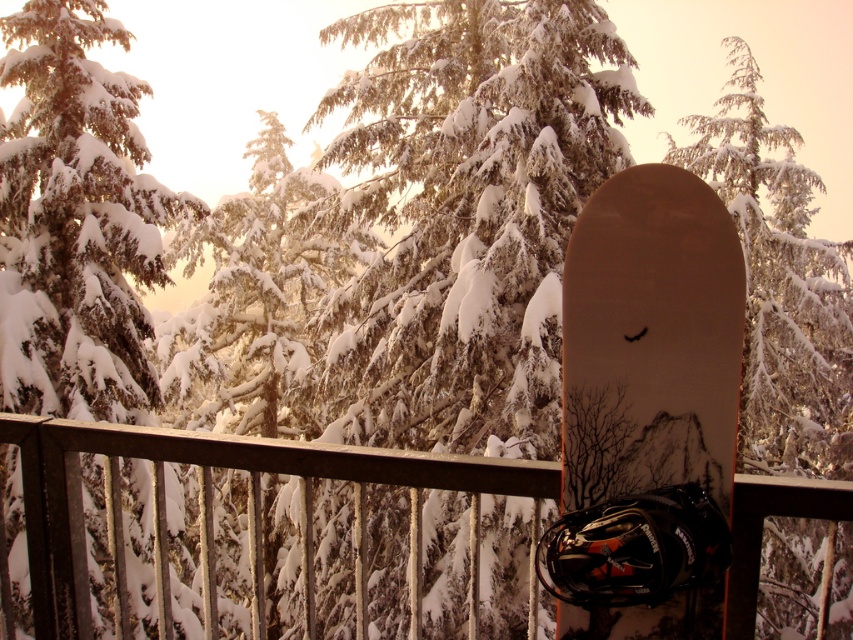
Who is taller, green matte tree at center or snowy pine tree at center?

With more height is snowy pine tree at center.

Measure the distance between green matte tree at center and camera.

green matte tree at center and camera are 9.71 feet apart from each other.

This screenshot has width=853, height=640. Identify the location of green matte tree at center. click(x=76, y=221).

Between snowy pine tree at center and snowy evergreen tree at center, which one is positioned higher?

Positioned higher is snowy pine tree at center.

Does snowy pine tree at center appear under snowy evergreen tree at center?

No.

Which is in front, point (833, 330) or point (225, 225)?

Point (833, 330) is in front.

Identify the location of snowy pine tree at center. (779, 284).

Is point (689, 205) behind point (167, 394)?

No, (689, 205) is closer to viewer.

Image resolution: width=853 pixels, height=640 pixels. What are the coordinates of `matte brown snowboard at center` in the screenshot? It's located at (650, 339).

Is point (735, 248) closer to camera compared to point (223, 221)?

Yes, it is in front of point (223, 221).

This screenshot has width=853, height=640. What are the coordinates of `matte brown snowboard at center` in the screenshot? It's located at (650, 339).